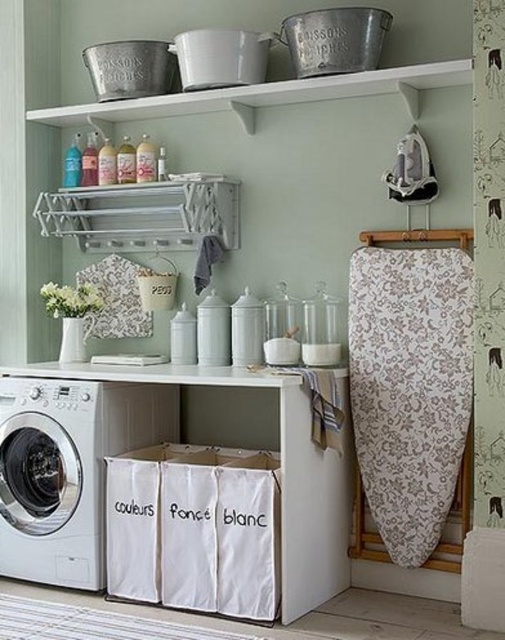
Between floral-patterned fabric at right and white fabric laundry basket at lower center, which one appears on the right side from the viewer's perspective?

floral-patterned fabric at right

Is point (390, 465) positioned in front of point (133, 548)?

That is False.

Which is in front, point (418, 284) or point (277, 488)?

Point (277, 488) is more forward.

Image resolution: width=505 pixels, height=640 pixels. Identify the location of floral-patterned fabric at right. (410, 387).

Which is above, floral-patterned fabric at right or white matte washing machine at lower left?

floral-patterned fabric at right

Who is positioned more to the right, floral-patterned fabric at right or white matte washing machine at lower left?

floral-patterned fabric at right is more to the right.

Does point (425, 442) come behind point (7, 557)?

No, (425, 442) is in front of (7, 557).

This screenshot has width=505, height=640. Identify the location of floral-patterned fabric at right. 410,387.

Who is positioned more to the left, white fabric laundry basket at lower center or white matte washing machine at lower left?

white matte washing machine at lower left is more to the left.

This screenshot has width=505, height=640. Describe the element at coordinates (194, 529) in the screenshot. I see `white fabric laundry basket at lower center` at that location.

Who is more forward, (211,464) or (38,417)?

Point (38,417) is more forward.

Where is `white fabric laundry basket at lower center`? Image resolution: width=505 pixels, height=640 pixels. white fabric laundry basket at lower center is located at coordinates (194, 529).